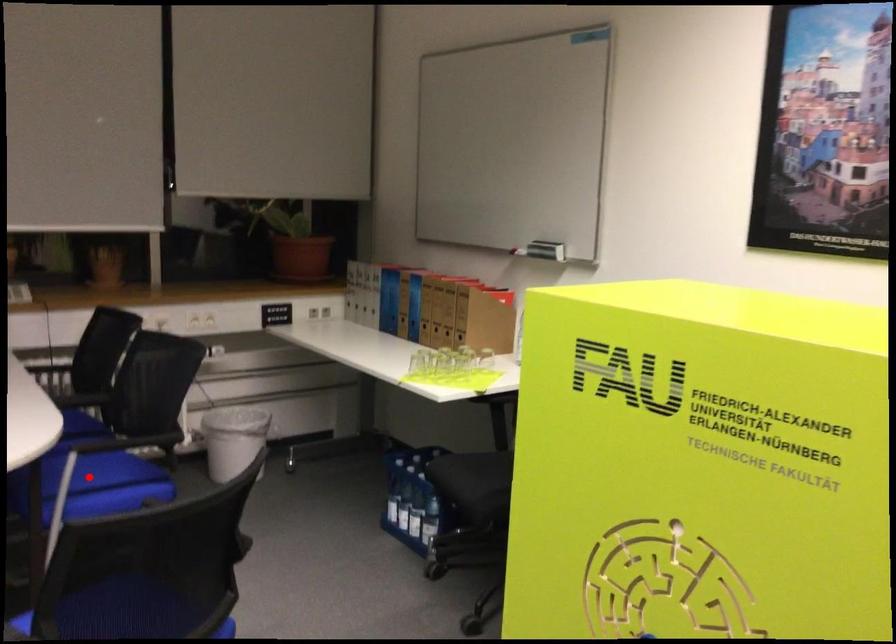
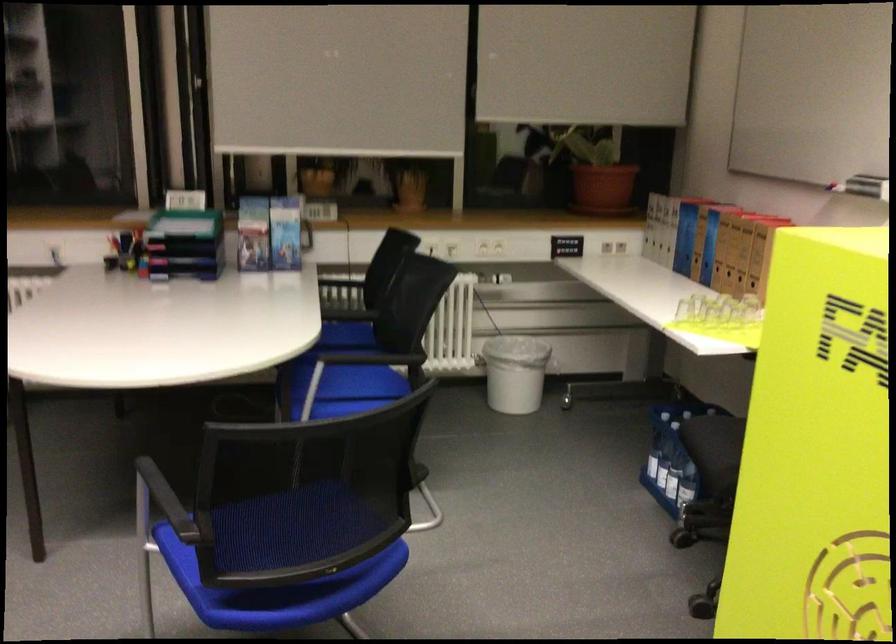
Where in the second image is the point corresponding to the highlighted location from the first image?

(349, 382)